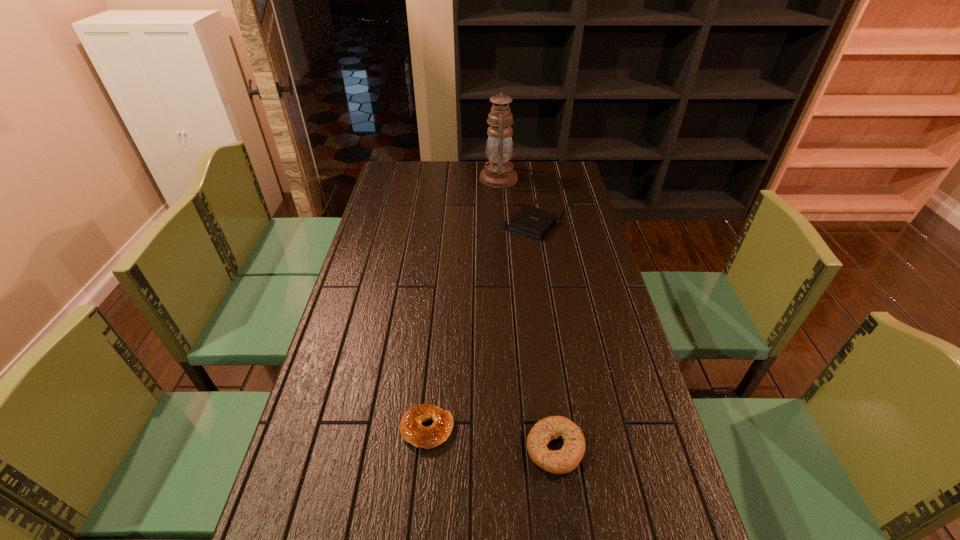
The width and height of the screenshot is (960, 540). In order to click on vacant space located 0.140m on the right of the shortest object in this screenshot , I will do `click(512, 429)`.

Image resolution: width=960 pixels, height=540 pixels. Identify the location of object present at the far edge. (498, 173).

Where is `object situated at the right edge`? object situated at the right edge is located at coordinates (530, 222).

The image size is (960, 540). I want to click on free space at the far edge of the desktop, so (527, 165).

The height and width of the screenshot is (540, 960). Identify the location of vacant position at the left edge of the desktop. (322, 488).

Identify the location of free location at the right edge of the desktop. The image size is (960, 540). (580, 241).

The image size is (960, 540). Identify the location of vacant position at the far right corner of the desktop. (549, 187).

You are a GUI agent. You are given a task and a screenshot of the screen. Output one action in this format:
    pyautogui.click(x=<x>, y=<y>)
    Task: Click on the free space between the router and the right bagel
    The height and width of the screenshot is (540, 960).
    Given the screenshot: What is the action you would take?
    [545, 337]

This screenshot has width=960, height=540. In order to click on blank region between the left bagel and the router in this screenshot , I will do `click(481, 327)`.

Identify the location of free area in between the second farthest object and the oil lamp. click(x=516, y=202).